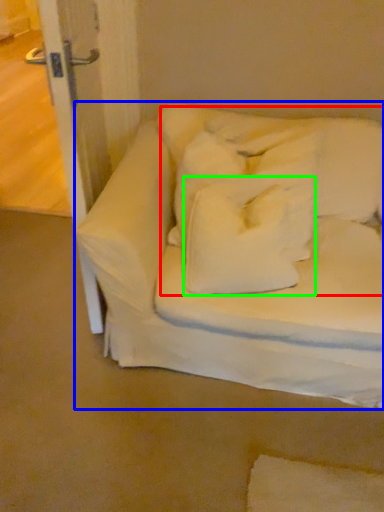
Question: Which is nearer to the bedding (highlighted by a red box)? furniture (highlighted by a blue box) or pillow (highlighted by a green box).

Choices:
 (A) furniture
 (B) pillow

Answer: (B)